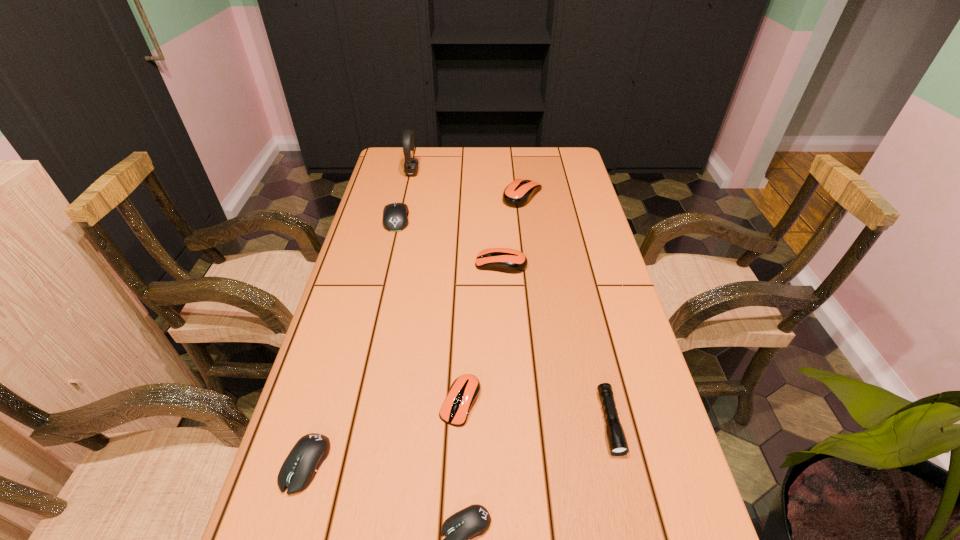
Find the location of a particular element. the tallest object is located at coordinates (411, 167).

Where is `the farthest orange computer mouse`? the farthest orange computer mouse is located at coordinates (517, 194).

Locate an element on the screen. Image resolution: width=960 pixels, height=540 pixels. the farthest black computer equipment is located at coordinates (395, 215).

Where is `the second smallest orange computer mouse`? The height and width of the screenshot is (540, 960). the second smallest orange computer mouse is located at coordinates point(506,260).

At what (x,y) coordinates should I click in order to perform the action: click on the fifth nearest object. Please return your answer as a coordinate pair (x, y). Looking at the image, I should click on (506, 260).

Locate an element on the screen. The image size is (960, 540). the second smallest black computer equipment is located at coordinates (297, 472).

This screenshot has width=960, height=540. Find the location of `the second farthest black computer equipment`. the second farthest black computer equipment is located at coordinates (297, 472).

Locate an element on the screen. flashlight is located at coordinates (616, 438).

You are a GUI agent. You are given a task and a screenshot of the screen. Output one action in this format:
    pyautogui.click(x=<x>, y=<y>)
    Task: Click on the black flashlight
    The height and width of the screenshot is (540, 960).
    Given the screenshot: What is the action you would take?
    pyautogui.click(x=616, y=438)

Identify the location of the third nearest computer equipment. The width and height of the screenshot is (960, 540). (464, 391).